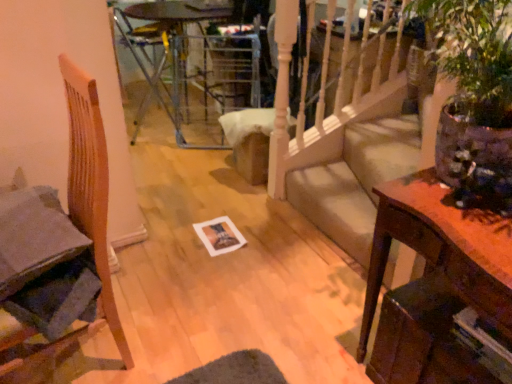
At what (x,y) coordinates should I click in order to perform the action: click on free point below wooden chair at left (from a real-world perspective). Please return your answer as a coordinate pair (x, y). Looking at the image, I should click on coord(100,351).